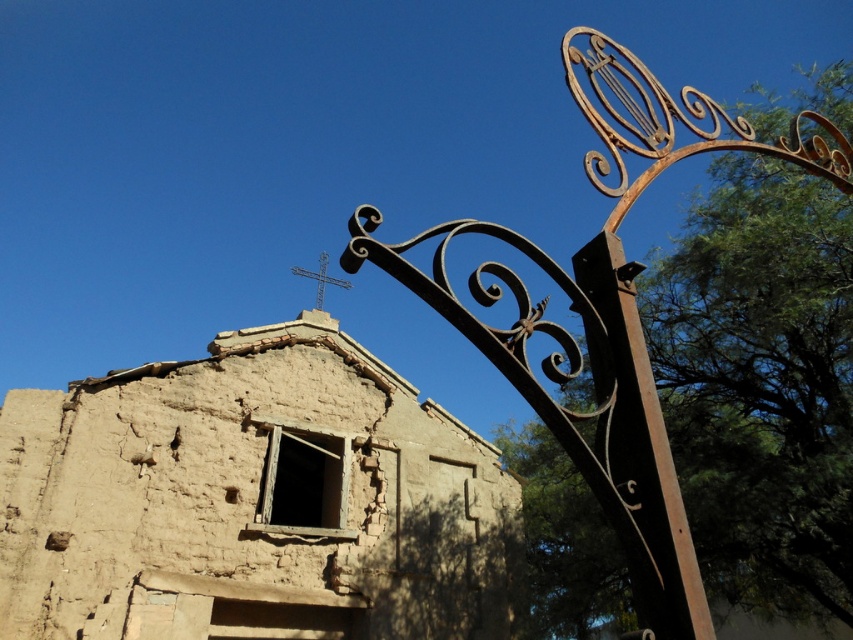
You are a delivery person with a cart that is 3 meters wide. You need to pass through the rusty metal gate at upper right to deliver packages to the building. Can your cart fit through the gate?

The distance between the rusty metal gate at upper right is 3.46 meters, so the cart which is 3 meters wide can fit through the gate since it is narrower than the available space.

You are standing at the entrance of the rustic building and see two points marked on the ground. The first point is at coordinates point (634, 547) and the second is at point (605, 316). Which point is closer to you as you face the building?

Point (634, 547) is closer to you because it is in front of point (605, 316).

You are a painter standing at the entrance of the building and want to paint both the rusty metal gate at upper right and the rusty metal pole at right. Which object should you look up to paint first?

The rusty metal gate at upper right is taller than the rusty metal pole at right, so you should look up to paint the rusty metal gate at upper right first because it is taller and requires adjusting your gaze upwards more.